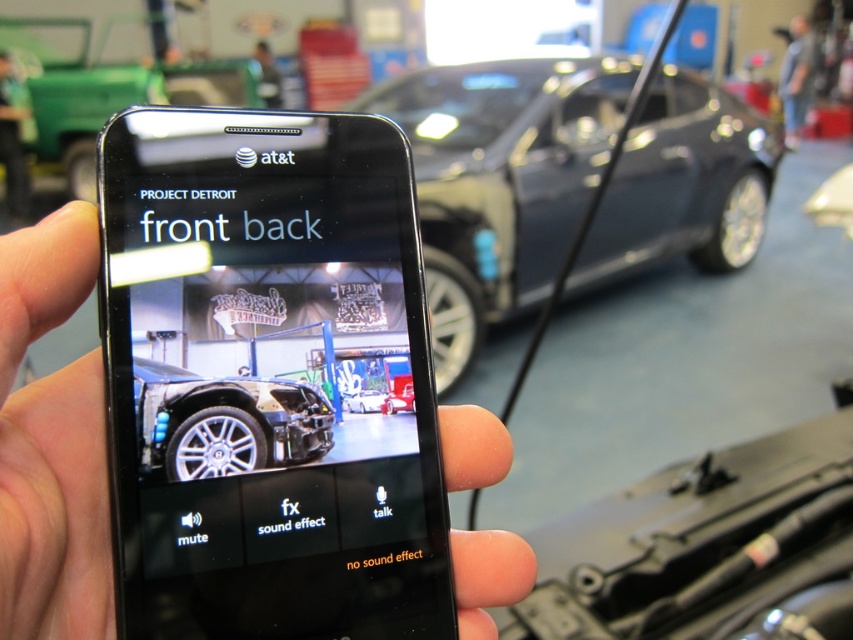
Question: Which object is closer to the camera taking this photo?

Choices:
 (A) black matte phone at center
 (B) gray fabric shirt at upper right

Answer: (A)

Question: Which object appears closest to the camera in this image?

Choices:
 (A) glossy metallic car at center
 (B) green fabric at upper left
 (C) gray fabric shirt at upper right

Answer: (A)

Question: Does black matte phone at center have a lesser width compared to green fabric at upper left?

Choices:
 (A) yes
 (B) no

Answer: (B)

Question: Can you confirm if glossy metallic car at center is positioned to the right of green fabric at upper left?

Choices:
 (A) yes
 (B) no

Answer: (A)

Question: Where is glossy metallic car at center located in relation to green fabric at upper left in the image?

Choices:
 (A) right
 (B) left

Answer: (A)

Question: Which object is closer to the camera taking this photo?

Choices:
 (A) green fabric at upper left
 (B) glossy metallic car at center
 (C) gray fabric shirt at upper right
 (D) black matte phone at center

Answer: (D)